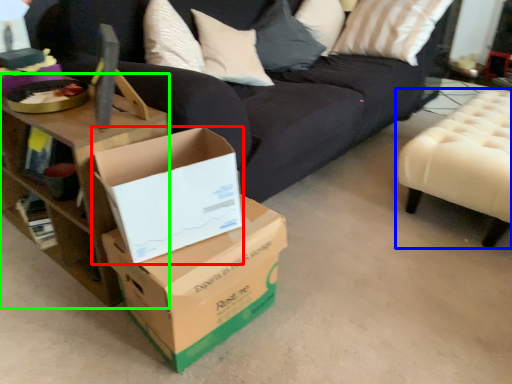
Question: Considering the real-world distances, which object is farthest from box (highlighted by a red box)? furniture (highlighted by a blue box) or table (highlighted by a green box)?

Choices:
 (A) furniture
 (B) table

Answer: (A)